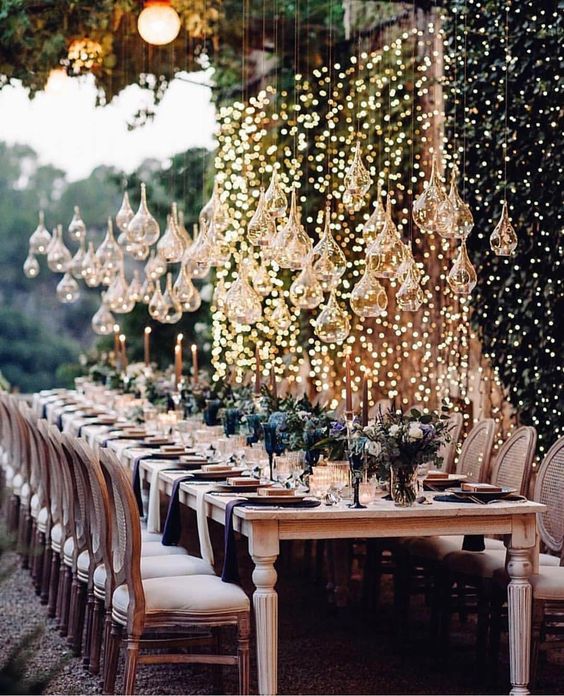
In order to click on chair cushion in this screenshot , I will do `click(555, 574)`, `click(471, 559)`, `click(438, 541)`, `click(185, 591)`, `click(166, 566)`, `click(156, 543)`, `click(148, 532)`.